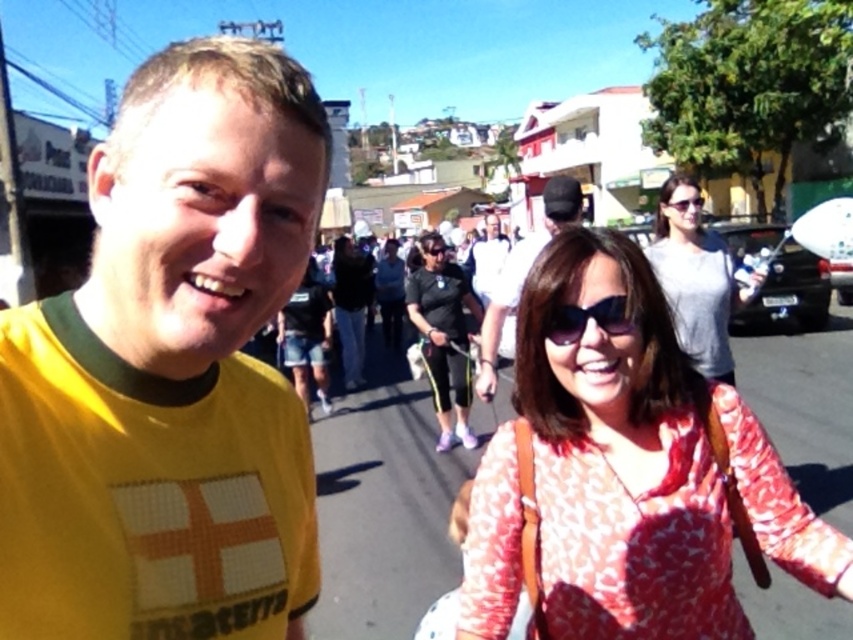
You are a photographer trying to capture a candid shot of the printed cotton blouse at center and sunglasses at center. Based on their positions, which one is more likely to be obscured by the other when taking the photo?

The printed cotton blouse at center is positioned under the sunglasses at center, so the sunglasses at center may obscure the printed cotton blouse at center in the photo.

You are a photographer standing in the middle of the street. You want to take a photo that includes both the yellow jersey at left and the printed cotton blouse at center. Which object should you focus on first to ensure both are in frame?

The yellow jersey at left is taller than the printed cotton blouse at center, so you should focus on the yellow jersey at left first to ensure both are in frame.